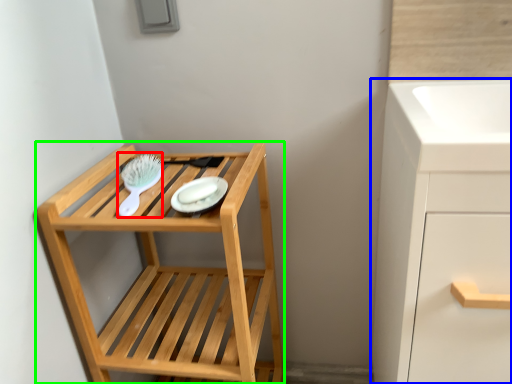
Question: Based on their relative distances, which object is nearer to brush (highlighted by a red box)? Choose from bathroom cabinet (highlighted by a blue box) and furniture (highlighted by a green box).

Choices:
 (A) bathroom cabinet
 (B) furniture

Answer: (B)